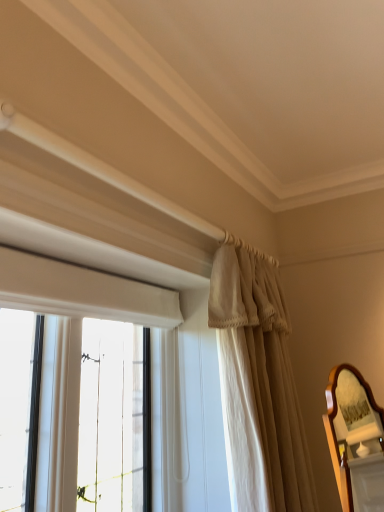
Question: From the image's perspective, is beige fabric curtain at upper right below wooden mirror at right?

Choices:
 (A) no
 (B) yes

Answer: (A)

Question: Is the depth of beige fabric curtain at upper right less than that of wooden mirror at right?

Choices:
 (A) yes
 (B) no

Answer: (B)

Question: Is beige fabric curtain at upper right next to wooden mirror at right?

Choices:
 (A) no
 (B) yes

Answer: (A)

Question: From a real-world perspective, is beige fabric curtain at upper right over wooden mirror at right?

Choices:
 (A) yes
 (B) no

Answer: (A)

Question: Considering the relative positions of beige fabric curtain at upper right and wooden mirror at right in the image provided, is beige fabric curtain at upper right to the left of wooden mirror at right from the viewer's perspective?

Choices:
 (A) no
 (B) yes

Answer: (B)

Question: Is there a large distance between beige fabric curtain at upper right and wooden mirror at right?

Choices:
 (A) no
 (B) yes

Answer: (B)

Question: Can you confirm if wooden mirror at right is thinner than beige fabric curtain at upper right?

Choices:
 (A) no
 (B) yes

Answer: (B)

Question: Is beige fabric curtain at upper right inside wooden mirror at right?

Choices:
 (A) yes
 (B) no

Answer: (B)

Question: Does wooden mirror at right have a smaller size compared to beige fabric curtain at upper right?

Choices:
 (A) yes
 (B) no

Answer: (A)

Question: Considering the relative sizes of wooden mirror at right and beige fabric curtain at upper right in the image provided, is wooden mirror at right shorter than beige fabric curtain at upper right?

Choices:
 (A) no
 (B) yes

Answer: (B)

Question: Is wooden mirror at right in front of beige fabric curtain at upper right?

Choices:
 (A) no
 (B) yes

Answer: (B)

Question: Is wooden mirror at right to the right of beige fabric curtain at upper right from the viewer's perspective?

Choices:
 (A) no
 (B) yes

Answer: (B)

Question: In terms of height, does beige fabric curtain at upper right look taller or shorter compared to wooden mirror at right?

Choices:
 (A) short
 (B) tall

Answer: (B)